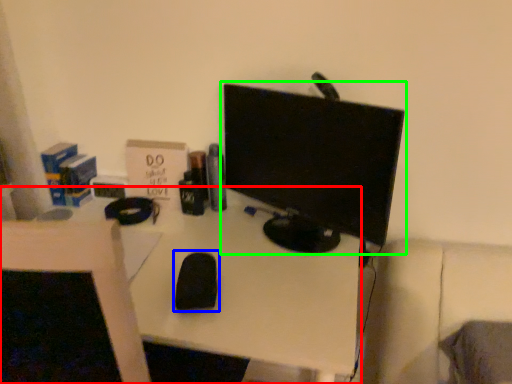
Question: Which is farther away from desk (highlighted by a red box)? mouse (highlighted by a blue box) or computer monitor (highlighted by a green box)?

Choices:
 (A) mouse
 (B) computer monitor

Answer: (B)